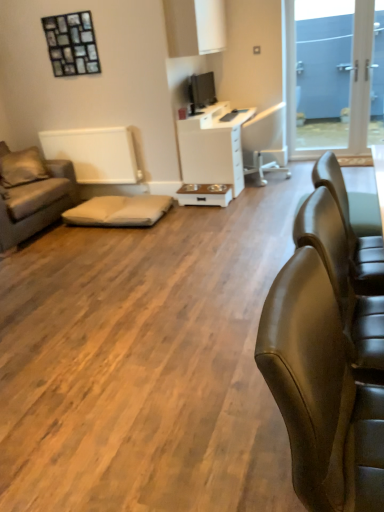
Question: Is leather couch at right, the second chair when ordered from bottom to top, further to camera compared to beige fabric pillow at left?

Choices:
 (A) no
 (B) yes

Answer: (A)

Question: Is leather couch at right, which appears as the 1th chair when viewed from the top, shorter than beige fabric pillow at left?

Choices:
 (A) no
 (B) yes

Answer: (A)

Question: Does leather couch at right, the 2th chair from the front, appear on the left side of beige fabric pillow at left?

Choices:
 (A) yes
 (B) no

Answer: (B)

Question: Can you confirm if leather couch at right, which appears as the 1th chair when viewed from the top, is smaller than beige fabric pillow at left?

Choices:
 (A) yes
 (B) no

Answer: (B)

Question: Is beige fabric pillow at left located within leather couch at right, the second chair when ordered from bottom to top?

Choices:
 (A) no
 (B) yes

Answer: (A)

Question: Considering the relative positions of leather couch at right, which is the 1th chair in back-to-front order, and beige fabric pillow at left in the image provided, is leather couch at right, which is the 1th chair in back-to-front order, in front of beige fabric pillow at left?

Choices:
 (A) no
 (B) yes

Answer: (B)

Question: Can you confirm if white glossy desk at center is smaller than brown fabric couch at left?

Choices:
 (A) no
 (B) yes

Answer: (B)

Question: Is white glossy desk at center beside brown fabric couch at left?

Choices:
 (A) yes
 (B) no

Answer: (B)

Question: From a real-world perspective, is white glossy desk at center under brown fabric couch at left?

Choices:
 (A) no
 (B) yes

Answer: (B)

Question: Is white glossy desk at center taller than brown fabric couch at left?

Choices:
 (A) yes
 (B) no

Answer: (A)

Question: Is white glossy desk at center shorter than brown fabric couch at left?

Choices:
 (A) yes
 (B) no

Answer: (B)

Question: Would you say white glossy desk at center is outside brown fabric couch at left?

Choices:
 (A) yes
 (B) no

Answer: (A)

Question: Can you confirm if leather couch at right, acting as the 1th chair starting from the front, is thinner than blue glass door at upper right?

Choices:
 (A) no
 (B) yes

Answer: (A)